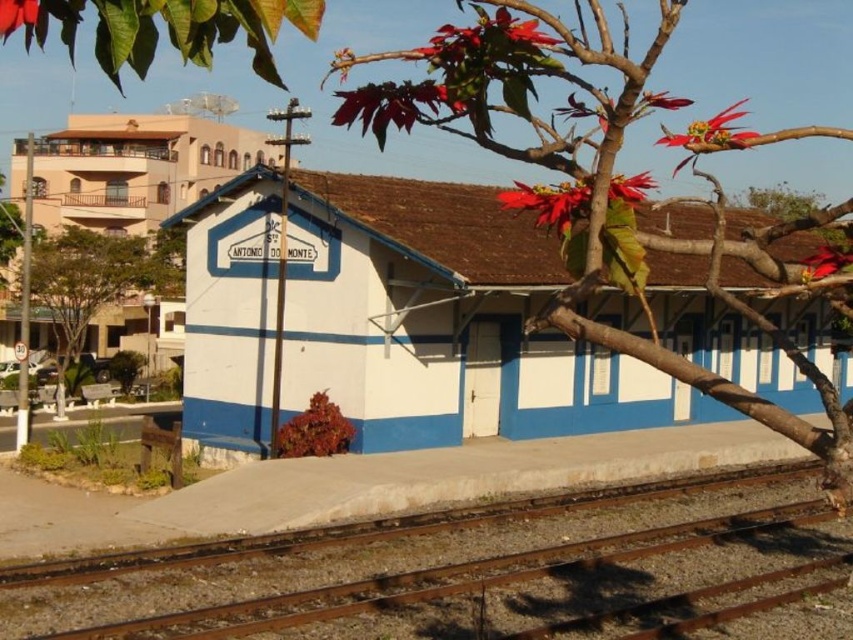
Question: Based on their relative distances, which object is nearer to the matte red flower at upper left?

Choices:
 (A) vibrant red petals at upper right
 (B) shiny red flower at upper right
 (C) white painted wood railway station at center
 (D) shiny red petals at upper center

Answer: (B)

Question: Can you confirm if vibrant red petals at upper right is positioned to the right of shiny red flower at upper right?

Choices:
 (A) yes
 (B) no

Answer: (A)

Question: Which object is farther from the camera taking this photo?

Choices:
 (A) red matte flower at upper right
 (B) green leafy tree at left
 (C) vibrant red petals at upper right
 (D) matte red flower at upper left

Answer: (B)

Question: In this image, where is rusty metal train track at lower center located relative to vibrant red petals at upper right?

Choices:
 (A) below
 (B) above

Answer: (A)

Question: Does matte red flower at upper left have a lesser width compared to red matte flower at upper right?

Choices:
 (A) no
 (B) yes

Answer: (B)

Question: Which point appears closest to the camera in this image?

Choices:
 (A) (526, 204)
 (B) (334, 188)
 (C) (28, 4)
 (D) (711, 502)

Answer: (C)